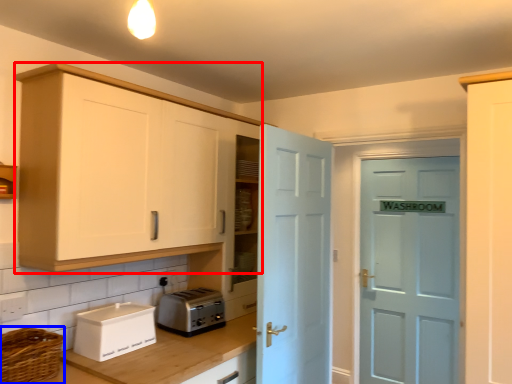
Question: Which object is further to the camera taking this photo, cabinetry (highlighted by a red box) or basket (highlighted by a blue box)?

Choices:
 (A) cabinetry
 (B) basket

Answer: (A)